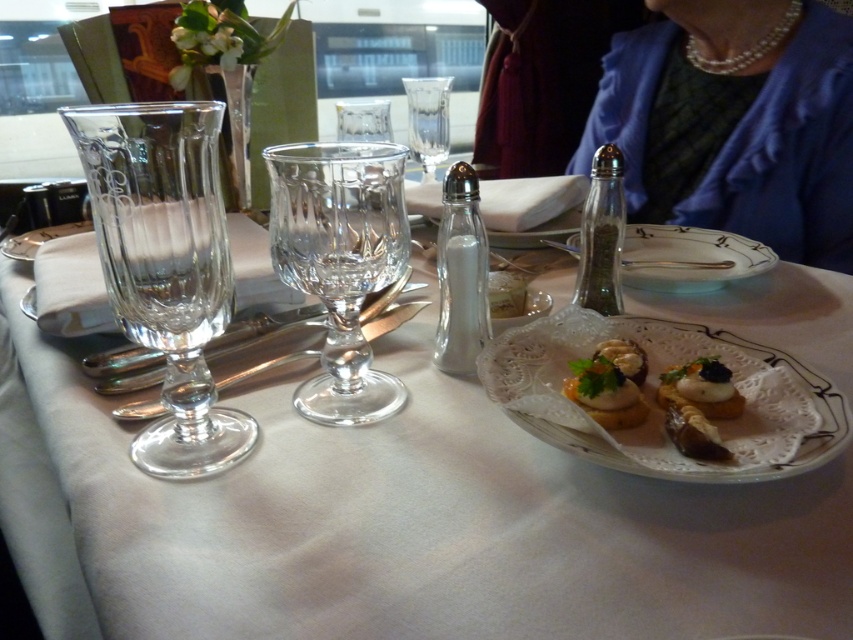
Question: Considering the relative positions of smooth cream cheese canapés at center and white glass salt shaker at center in the image provided, where is smooth cream cheese canapés at center located with respect to white glass salt shaker at center?

Choices:
 (A) below
 (B) above

Answer: (A)

Question: Which point appears farthest from the camera in this image?

Choices:
 (A) (621, 394)
 (B) (708, 432)
 (C) (379, 401)
 (D) (405, 77)

Answer: (D)

Question: Does clear glass wine glass at left have a greater width compared to smooth cream cheese canapés at center?

Choices:
 (A) no
 (B) yes

Answer: (A)

Question: Estimate the real-world distances between objects in this image. Which object is farther from the smooth cream cheese canapés at center?

Choices:
 (A) transparent glass wine glass at center
 (B) clear glass wine glass at left
 (C) silver metallic spoon at upper center

Answer: (A)

Question: Where is clear glass plate at center located in relation to clear glass wine glass at left in the image?

Choices:
 (A) below
 (B) above

Answer: (A)

Question: Which object appears farthest from the camera in this image?

Choices:
 (A) white lace plate at lower right
 (B) silver metallic spoon at upper center
 (C) clear glass wine glass at center

Answer: (B)